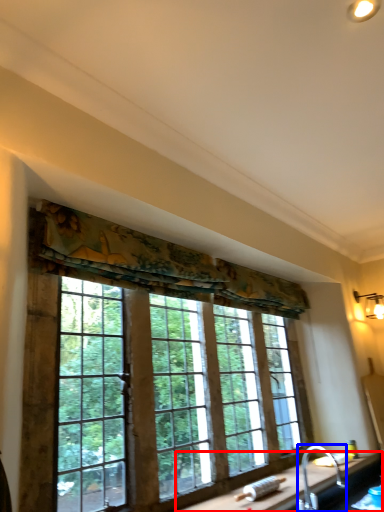
Question: Among these objects, which one is farthest to the camera, counter top (highlighted by a red box) or faucet (highlighted by a blue box)?

Choices:
 (A) counter top
 (B) faucet

Answer: (B)